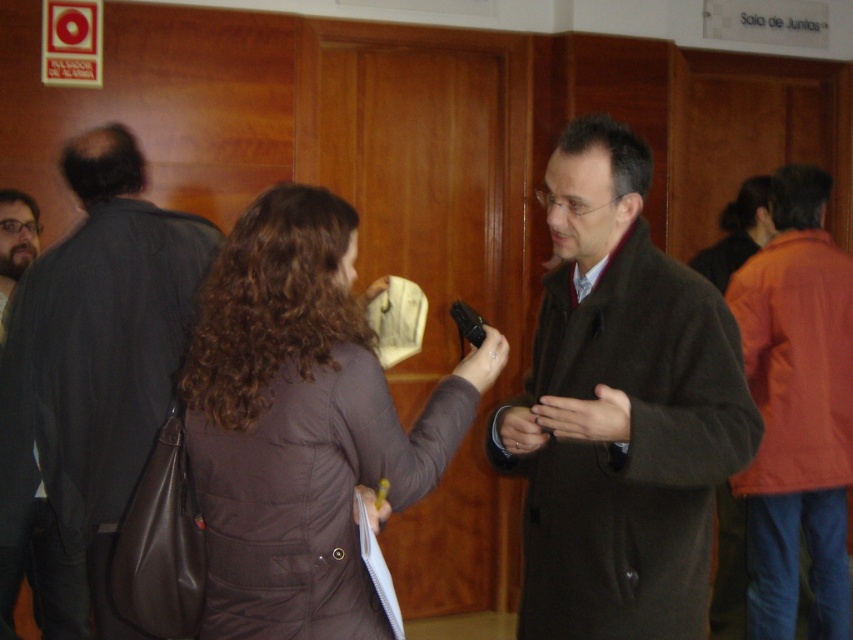
Question: Which object is the farthest from the brown wool coat at center?

Choices:
 (A) brown puffy coat at center
 (B) orange fabric jacket at right

Answer: (B)

Question: Does brown wool coat at center have a lesser width compared to dark gray coat at left?

Choices:
 (A) yes
 (B) no

Answer: (A)

Question: Which point is farther to the camera?

Choices:
 (A) (544, 460)
 (B) (838, 392)

Answer: (B)

Question: Considering the real-world distances, which object is closest to the dark gray coat at left?

Choices:
 (A) orange fabric jacket at right
 (B) brown wool coat at center

Answer: (B)

Question: Considering the relative positions of brown wool coat at center and brown puffy coat at center in the image provided, where is brown wool coat at center located with respect to brown puffy coat at center?

Choices:
 (A) above
 (B) below

Answer: (A)

Question: Is the position of dark gray coat at left less distant than that of orange fabric jacket at right?

Choices:
 (A) yes
 (B) no

Answer: (A)